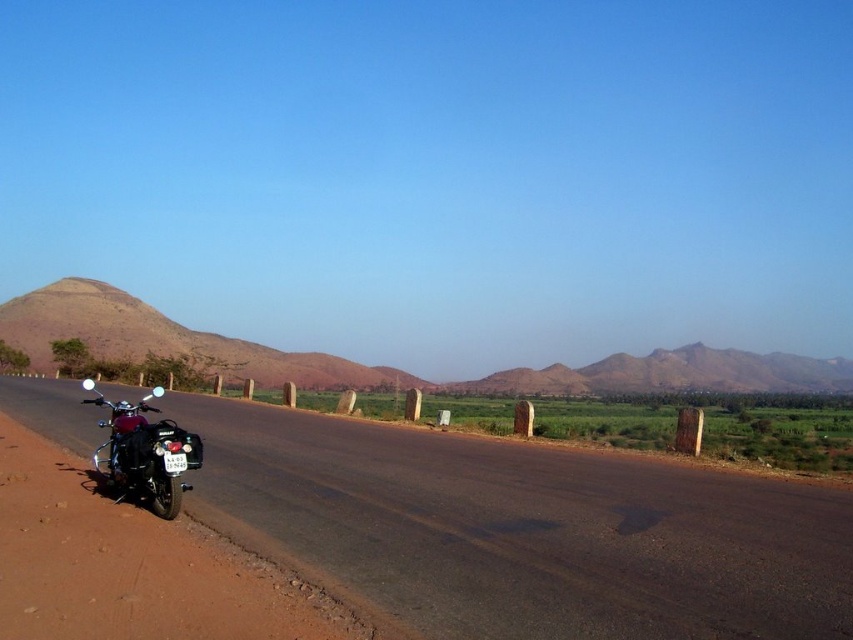
Question: Can you confirm if brown matte mountain at left is thinner than shiny chrome motorcycle at left?

Choices:
 (A) yes
 (B) no

Answer: (B)

Question: Which of these objects is positioned closest to the shiny chrome motorcycle at left?

Choices:
 (A) brown matte mountain at left
 (B) brown dirt track at lower left

Answer: (B)

Question: Does brown matte mountain at left appear on the left side of shiny chrome motorcycle at left?

Choices:
 (A) yes
 (B) no

Answer: (A)

Question: Among these objects, which one is nearest to the camera?

Choices:
 (A) shiny chrome motorcycle at left
 (B) brown dirt track at lower left
 (C) brown matte mountain at left

Answer: (B)

Question: Which object appears closest to the camera in this image?

Choices:
 (A) brown matte mountain at left
 (B) brown dirt track at lower left
 (C) shiny chrome motorcycle at left

Answer: (B)

Question: Does brown matte mountain at left have a lesser width compared to shiny chrome motorcycle at left?

Choices:
 (A) no
 (B) yes

Answer: (A)